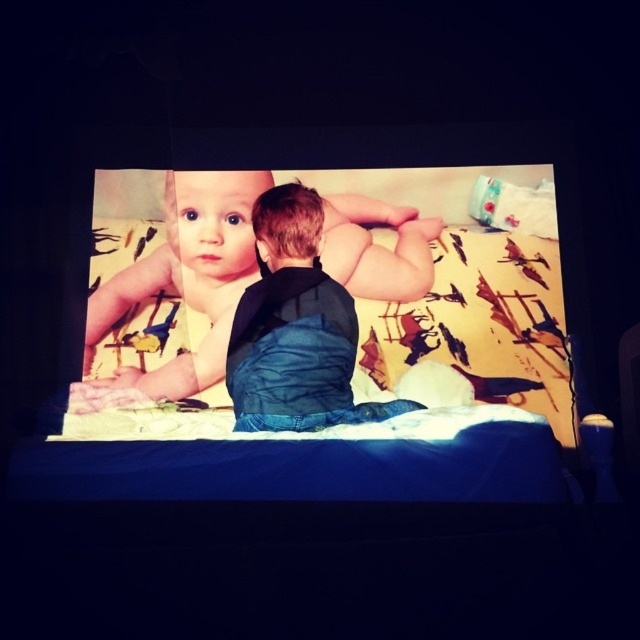
You are a photographer trying to capture the perfect shot of the yellow fabric bed at center. You need to position your camera exactly at the center point of the bed. According to the scene description, where should you aim your camera?

The 2D location of the yellow fabric bed at center is at point [356,348], so you should aim your camera at those coordinates to capture the center of the bed.